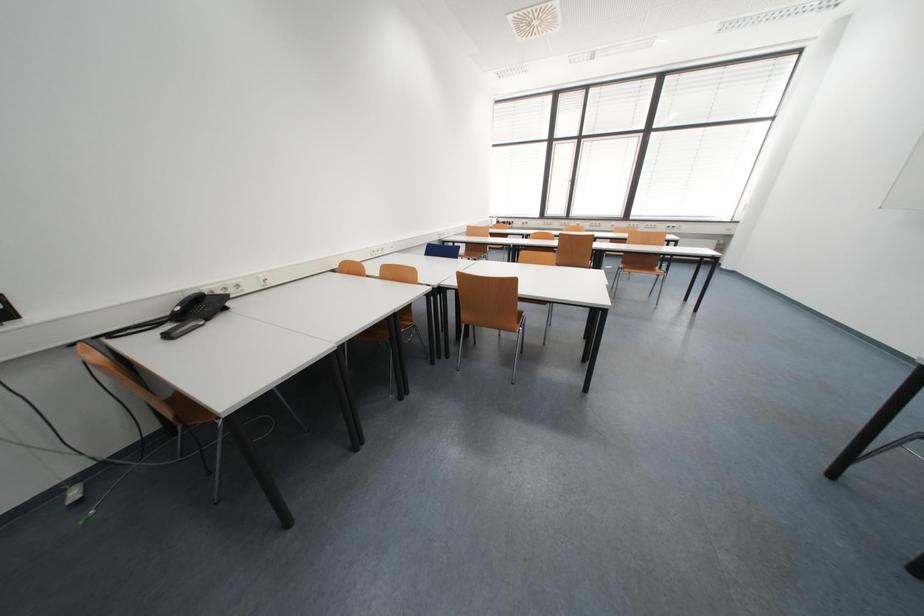
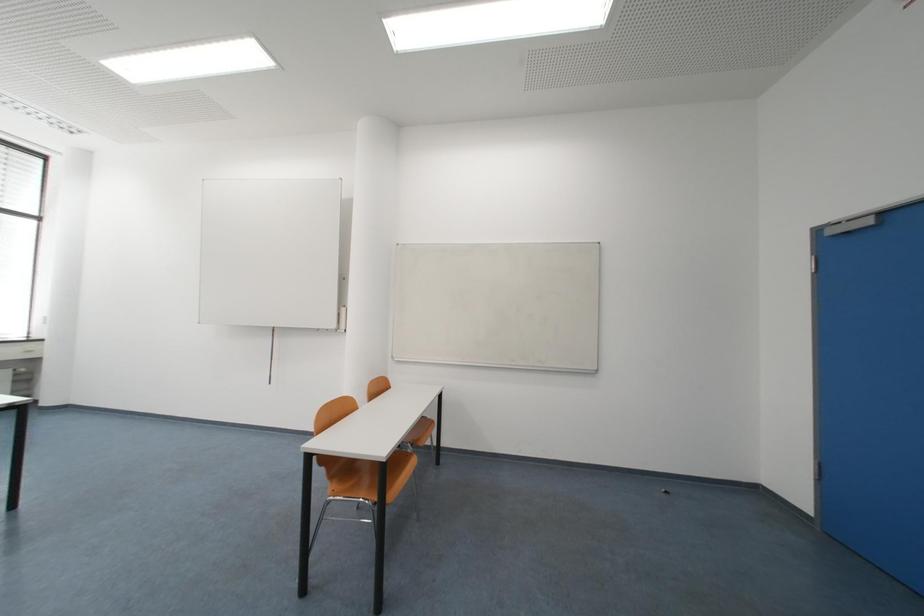
Question: The images are taken continuously from a first-person perspective. In which direction is your viewpoint rotating?

Choices:
 (A) Left
 (B) Right
 (C) Up
 (D) Down

Answer: (B)